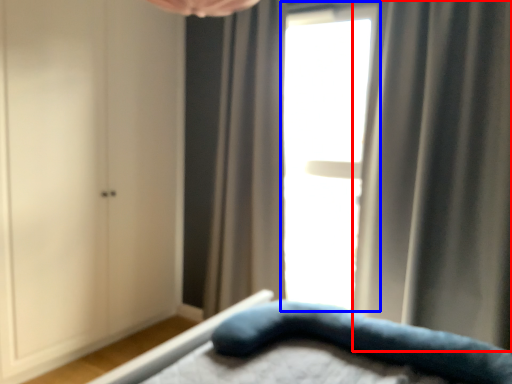
Question: Among these objects, which one is nearest to the camera, curtain (highlighted by a red box) or window (highlighted by a blue box)?

Choices:
 (A) curtain
 (B) window

Answer: (A)